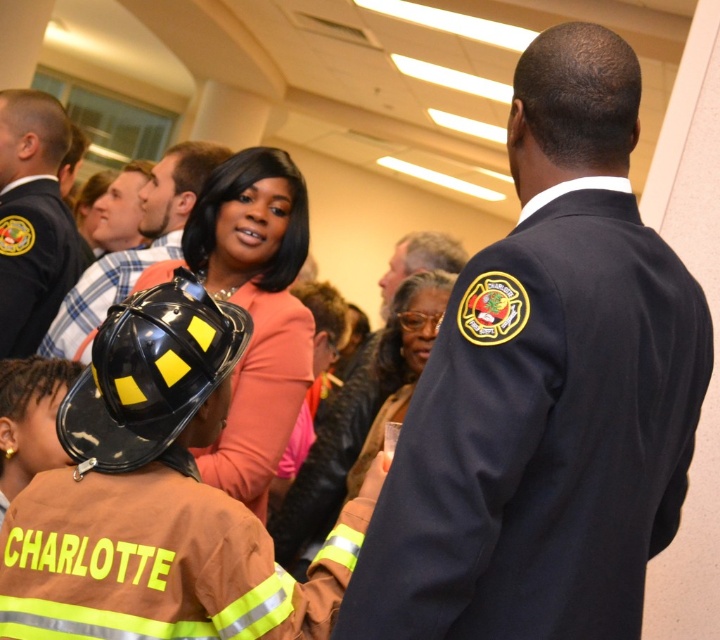
Question: Which object is farther from the camera taking this photo?

Choices:
 (A) brown matte fire helmet at center
 (B) navy blue uniform at center

Answer: (A)

Question: Which object is positioned closest to the navy blue uniform at center?

Choices:
 (A) black matte helmet at center
 (B) black uniform at left
 (C) matte black helmet at center
 (D) black matte helmet at lower left

Answer: (D)

Question: Does black matte helmet at center appear on the right side of brown fabric fire helmet at lower left?

Choices:
 (A) no
 (B) yes

Answer: (A)

Question: Does navy blue uniform at center have a larger size compared to dark brown leather jacket at center?

Choices:
 (A) no
 (B) yes

Answer: (B)

Question: Among these objects, which one is nearest to the camera?

Choices:
 (A) brown matte fire helmet at center
 (B) dark brown leather jacket at center

Answer: (A)

Question: Is navy blue uniform at center positioned before black matte helmet at lower left?

Choices:
 (A) yes
 (B) no

Answer: (A)